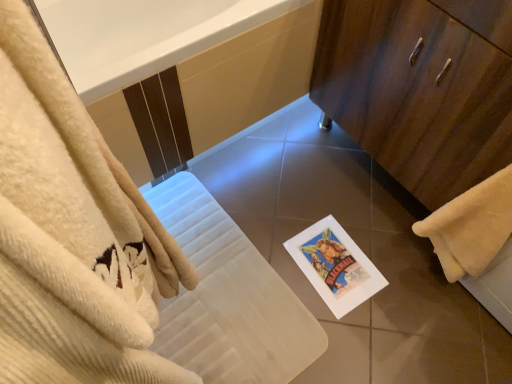
Question: Considering the positions of point (494, 235) and point (269, 87), is point (494, 235) closer or farther from the camera than point (269, 87)?

Choices:
 (A) closer
 (B) farther

Answer: (A)

Question: Choose the correct answer: Is yellow fluffy towel at lower right inside white glossy bathtub at upper center or outside it?

Choices:
 (A) outside
 (B) inside

Answer: (A)

Question: Which is nearer to the yellow fluffy towel at lower right?

Choices:
 (A) white glossy bathtub at upper center
 (B) white paper postcard at center
 (C) wooden cabinet at right

Answer: (C)

Question: Which object is the closest to the yellow fluffy towel at lower right?

Choices:
 (A) wooden cabinet at right
 (B) white glossy bathtub at upper center
 (C) white paper postcard at center

Answer: (A)